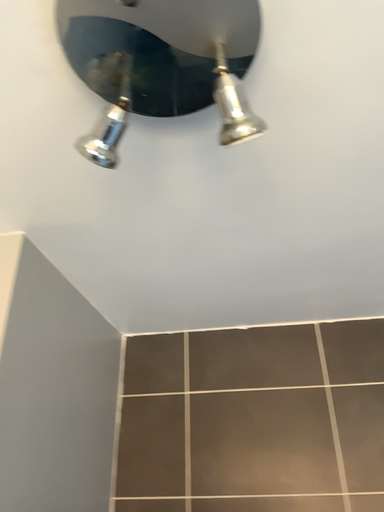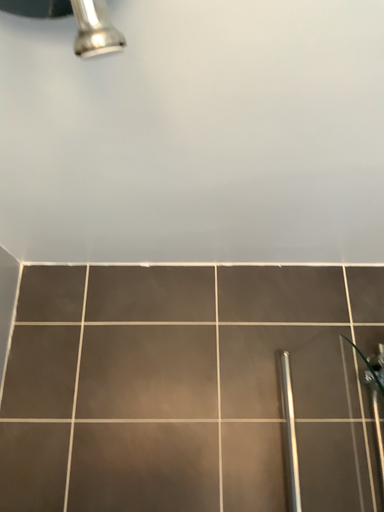
Question: How did the camera likely rotate when shooting the video?

Choices:
 (A) rotated upward
 (B) rotated downward

Answer: (B)